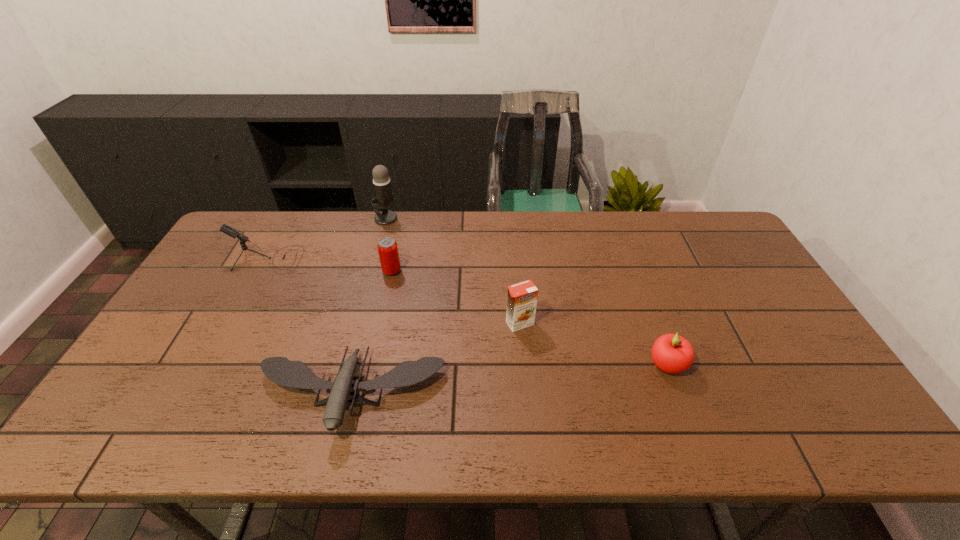
Where is `the farthest object`? the farthest object is located at coordinates (383, 191).

The width and height of the screenshot is (960, 540). What are the coordinates of `the tallest object` in the screenshot? It's located at (383, 191).

The image size is (960, 540). I want to click on the fifth object from left to right, so click(522, 298).

The width and height of the screenshot is (960, 540). What are the coordinates of `the fourth farthest object` in the screenshot? It's located at (522, 298).

What are the coordinates of `the left microphone` in the screenshot? It's located at (232, 232).

This screenshot has width=960, height=540. Find the location of `the nearer microphone`. the nearer microphone is located at coordinates (232, 232).

Locate an element on the screen. can is located at coordinates (387, 247).

You are a GUI agent. You are given a task and a screenshot of the screen. Output one action in this format:
    pyautogui.click(x=<x>, y=<y>)
    Task: Click on the apple
    This screenshot has width=960, height=540.
    Given the screenshot: What is the action you would take?
    pyautogui.click(x=671, y=353)

The image size is (960, 540). What are the coordinates of `the shortest object` in the screenshot? It's located at [x=280, y=370].

The height and width of the screenshot is (540, 960). Identify the location of vacant space situated on the left of the taller microphone. (269, 218).